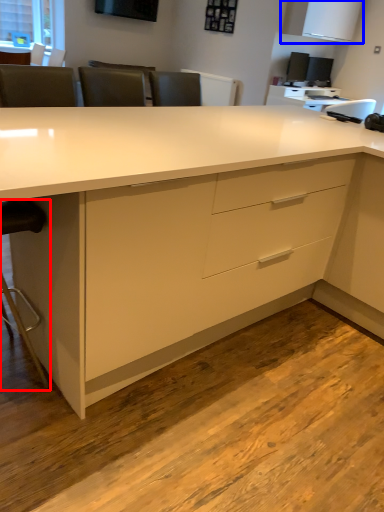
Question: Which point is closer to the camera, swivel chair (highlighted by a red box) or cabinetry (highlighted by a blue box)?

Choices:
 (A) swivel chair
 (B) cabinetry

Answer: (A)